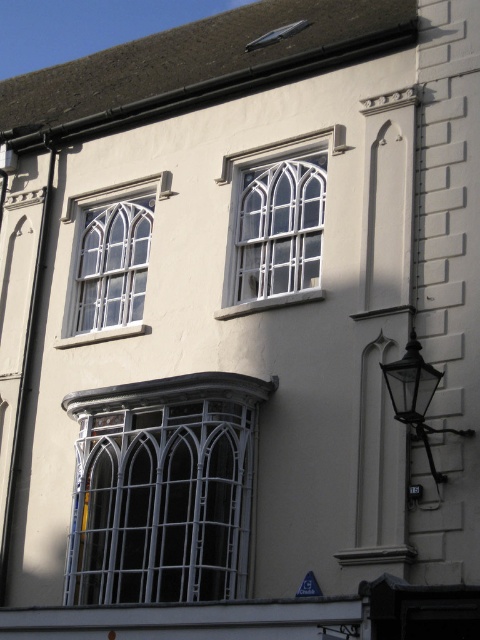
Question: Estimate the real-world distances between objects in this image. Which object is farther from the white metal window at center?

Choices:
 (A) white glass window at upper center
 (B) black glass lamp at right

Answer: (A)

Question: Which object is the closest to the blue plastic sign at lower center?

Choices:
 (A) white glass window at upper center
 (B) black glass lamp at right

Answer: (B)

Question: Observing the image, what is the correct spatial positioning of white glass window at upper center in reference to black glass lamp at right?

Choices:
 (A) above
 (B) below

Answer: (A)

Question: Does white metal window at center lie in front of white glass window at upper center?

Choices:
 (A) yes
 (B) no

Answer: (A)

Question: Which of the following is the farthest from the observer?

Choices:
 (A) (243, 444)
 (B) (314, 592)

Answer: (A)

Question: Does white metal window at center have a greater width compared to black glass lamp at right?

Choices:
 (A) no
 (B) yes

Answer: (A)